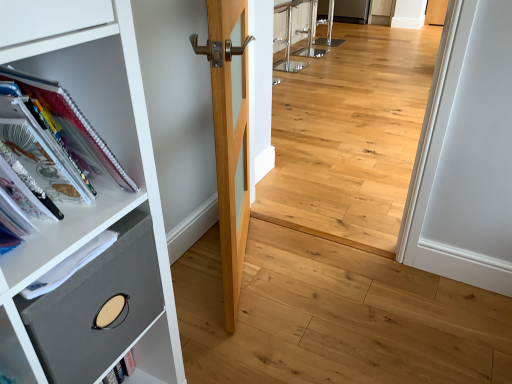
Question: From the image's perspective, is natural wood floor at center beneath light wood door at center?

Choices:
 (A) yes
 (B) no

Answer: (B)

Question: Does natural wood floor at center have a lesser height compared to light wood door at center?

Choices:
 (A) no
 (B) yes

Answer: (B)

Question: From a real-world perspective, is natural wood floor at center under light wood door at center?

Choices:
 (A) no
 (B) yes

Answer: (B)

Question: Is natural wood floor at center not close to light wood door at center?

Choices:
 (A) no
 (B) yes

Answer: (B)

Question: Does natural wood floor at center have a greater width compared to light wood door at center?

Choices:
 (A) no
 (B) yes

Answer: (A)

Question: Is natural wood floor at center taller than light wood door at center?

Choices:
 (A) no
 (B) yes

Answer: (A)

Question: Considering the relative sizes of gray fabric drawer at left and light wood door at center in the image provided, is gray fabric drawer at left thinner than light wood door at center?

Choices:
 (A) yes
 (B) no

Answer: (B)

Question: Can we say gray fabric drawer at left lies outside light wood door at center?

Choices:
 (A) yes
 (B) no

Answer: (A)

Question: Is light wood door at center inside gray fabric drawer at left?

Choices:
 (A) yes
 (B) no

Answer: (B)

Question: Is the depth of gray fabric drawer at left less than that of light wood door at center?

Choices:
 (A) yes
 (B) no

Answer: (A)

Question: From the image's perspective, does gray fabric drawer at left appear higher than light wood door at center?

Choices:
 (A) no
 (B) yes

Answer: (A)

Question: Could you tell me if gray fabric drawer at left is facing light wood door at center?

Choices:
 (A) yes
 (B) no

Answer: (B)

Question: Can you confirm if light wood door at center is smaller than spiral-bound paper at left?

Choices:
 (A) yes
 (B) no

Answer: (B)